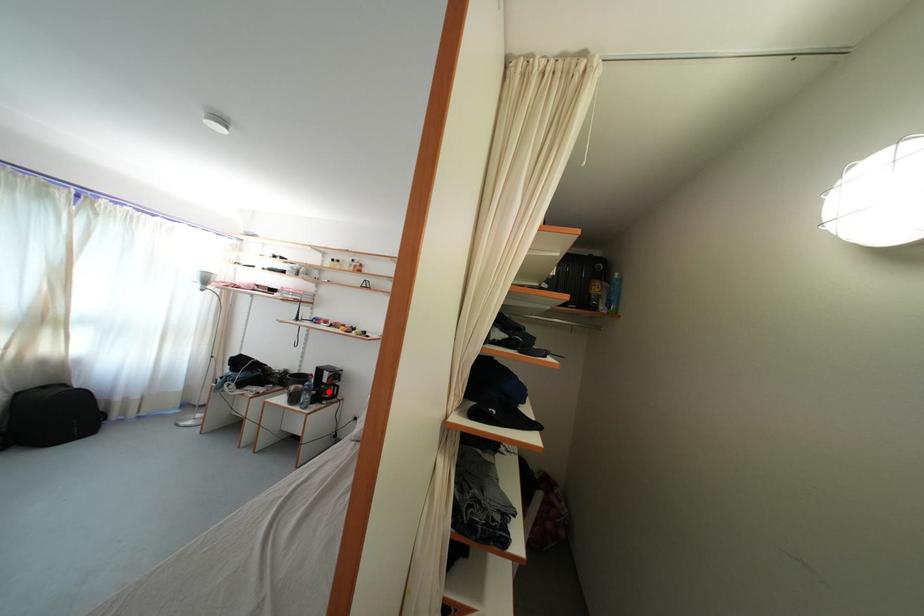
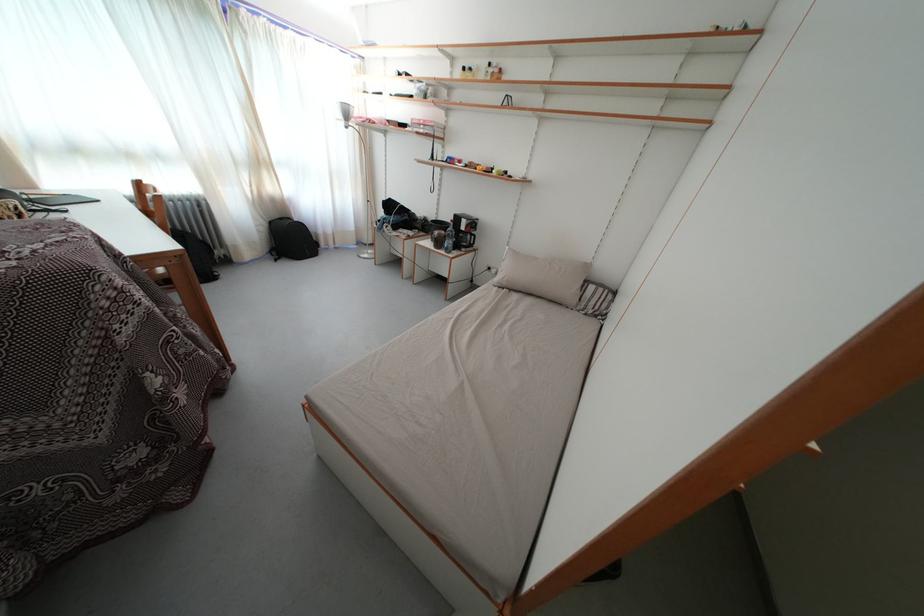
In the second image, find the point that corresponds to the highlighted location in the first image.

(467, 240)